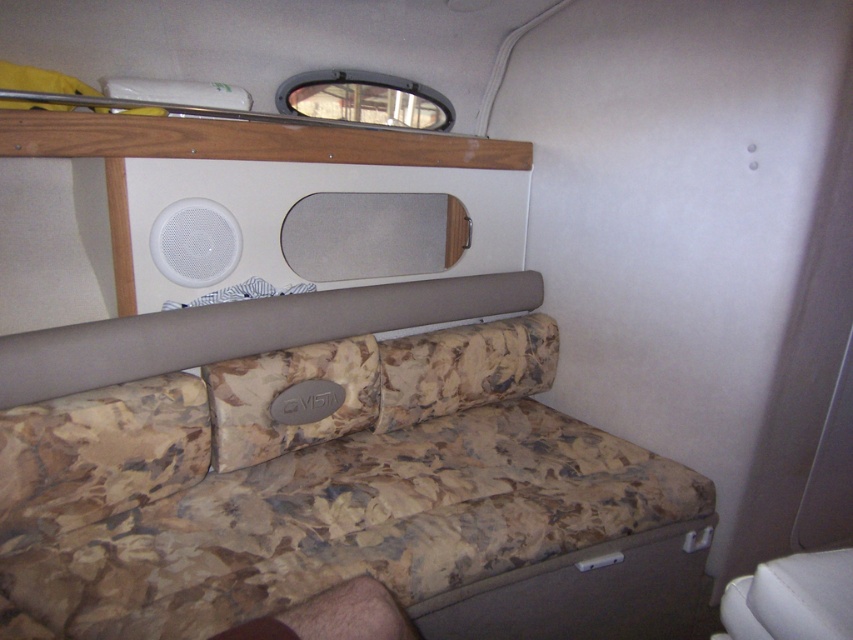
Question: Which of these objects is positioned closest to the camouflage fabric pillow at center?

Choices:
 (A) white plastic speaker at upper left
 (B) camouflage fabric couch at center

Answer: (B)

Question: Is camouflage fabric couch at center wider than camouflage fabric pillow at center?

Choices:
 (A) no
 (B) yes

Answer: (B)

Question: Which object is closer to the camera taking this photo?

Choices:
 (A) camouflage fabric couch at center
 (B) camouflage fabric pillow at center
 (C) white plastic speaker at upper left

Answer: (A)

Question: Is camouflage fabric pillow at center closer to camera compared to white plastic speaker at upper left?

Choices:
 (A) no
 (B) yes

Answer: (A)

Question: Which point is farther to the camera?

Choices:
 (A) white plastic speaker at upper left
 (B) camouflage fabric couch at center

Answer: (A)

Question: Observing the image, what is the correct spatial positioning of camouflage fabric pillow at center in reference to white plastic speaker at upper left?

Choices:
 (A) left
 (B) right

Answer: (B)